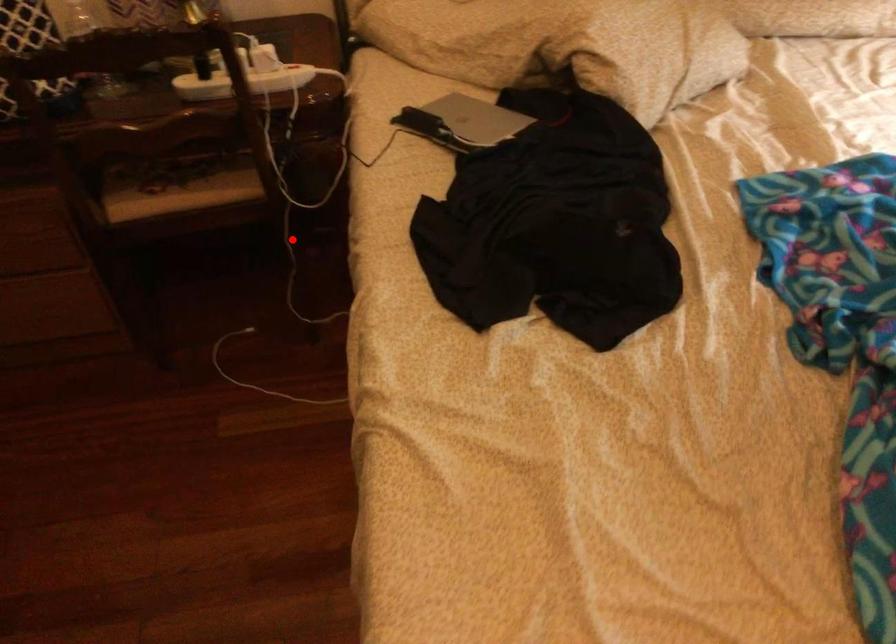
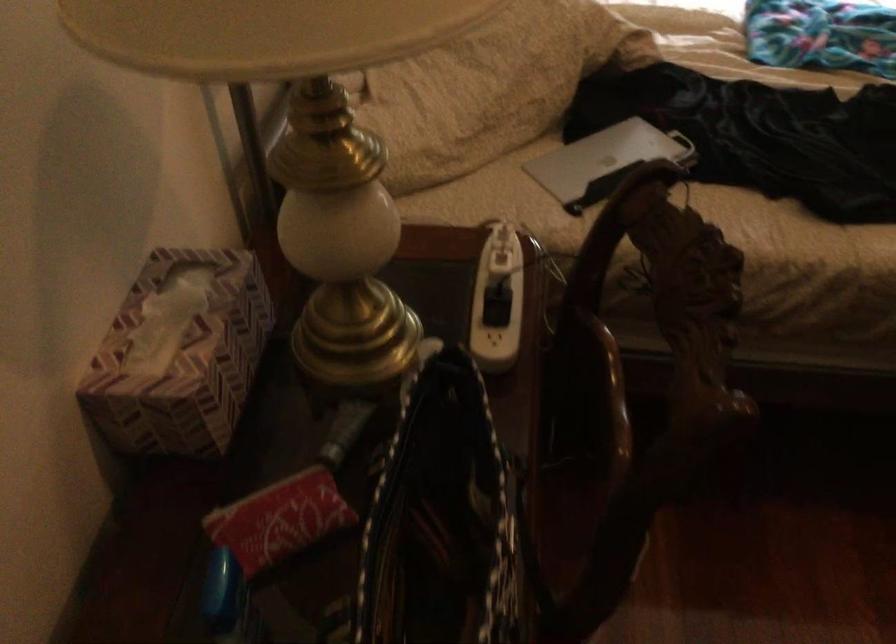
Question: I am providing you with two images of the same scene from different viewpoints. A red point is marked on the first image. Can you still see the location of the red point in image 2?

Choices:
 (A) Yes
 (B) No

Answer: (B)